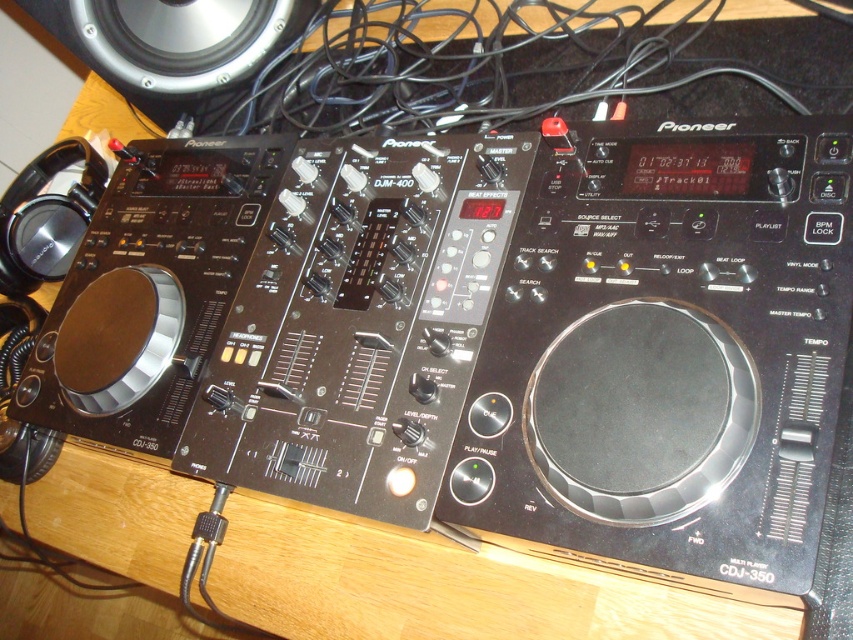
Question: Which point is farther to the camera?

Choices:
 (A) silver metallic speaker at upper left
 (B) black plastic wire at upper center

Answer: (A)

Question: Can you confirm if black plastic wire at upper center is positioned to the right of silver metallic speaker at upper left?

Choices:
 (A) yes
 (B) no

Answer: (A)

Question: Which point is closer to the camera?

Choices:
 (A) (332, 58)
 (B) (164, 49)

Answer: (B)

Question: Can you confirm if black plastic wire at upper center is positioned to the right of silver metallic speaker at upper left?

Choices:
 (A) yes
 (B) no

Answer: (A)

Question: In this image, where is black plastic wire at upper center located relative to silver metallic speaker at upper left?

Choices:
 (A) left
 (B) right

Answer: (B)